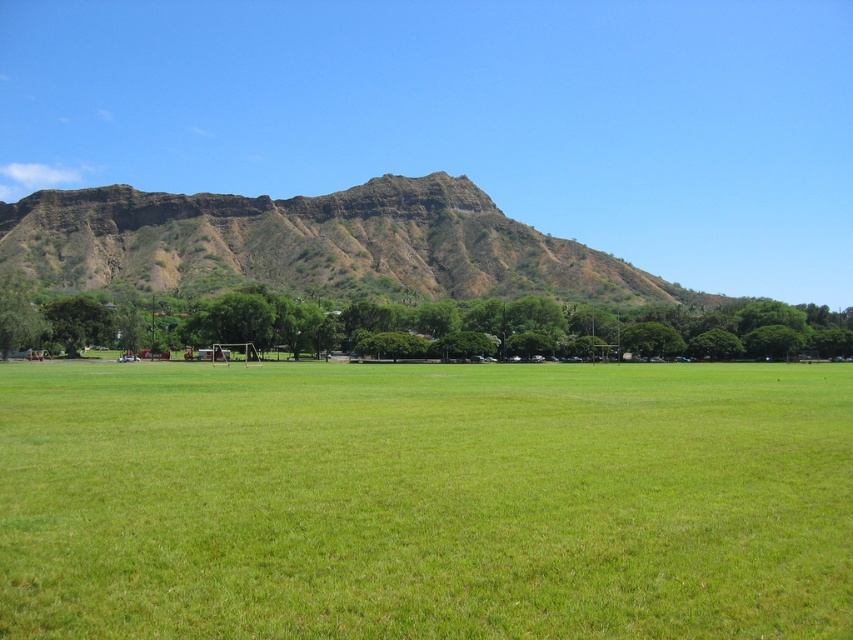
From the picture: You are planning to take a photo of the brown rocky mountain at upper center and the green leafy tree at center. Which object should you focus on first if you want to capture both in a single frame without moving the camera?

You should focus on the brown rocky mountain at upper center first because it is wider than the green leafy tree at center, allowing it to occupy more space in the frame while still including the tree.

You are planning to set up a picnic area in the park. You have a large picnic blanket that is 2 meters wide. Considering the space between the green grass at center and the green leafy tree at center, will your blanket fit without overlapping either of them?

The green grass at center is narrower than the green leafy tree at center. However, the exact width relationship between the grass and the tree isn

You are standing in the park and see the green grass at center and the green leafy tree at center. Which one is more to the right?

The green grass at center is more to the right because it is positioned on the right side of the green leafy tree at center.